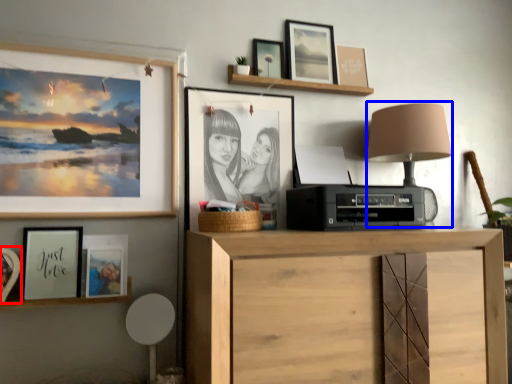
Question: Which object is further to the camera taking this photo, picture frame (highlighted by a red box) or table lamp (highlighted by a blue box)?

Choices:
 (A) picture frame
 (B) table lamp

Answer: (B)